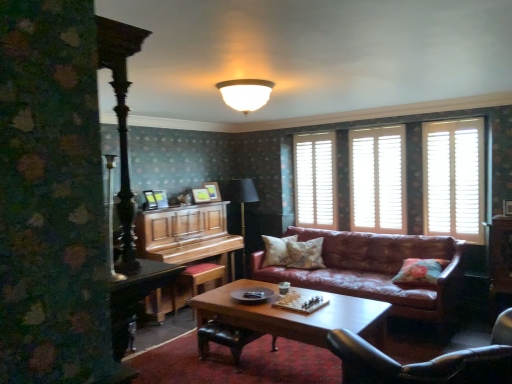
I want to click on free spot above white frosted glass lampshade at upper center (from a real-world perspective), so click(x=246, y=86).